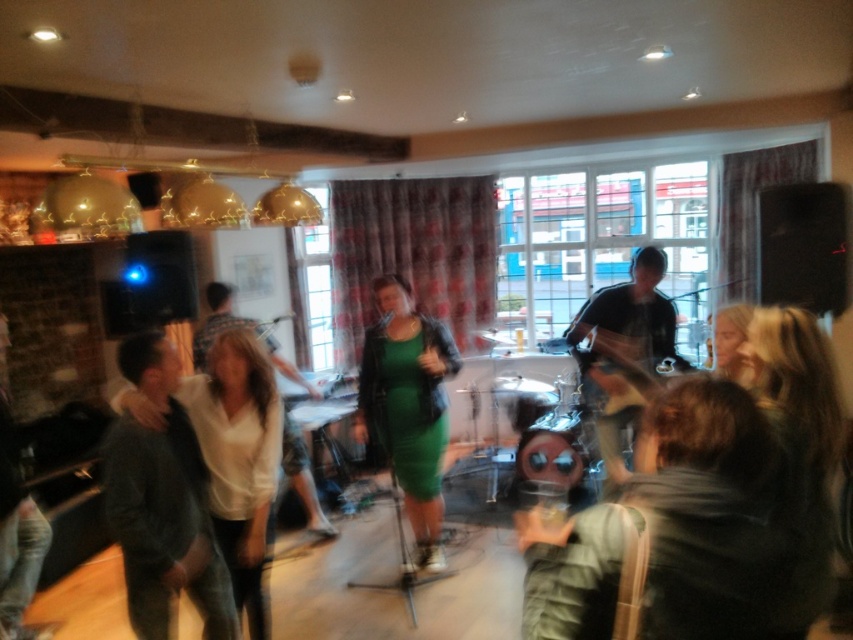
Where is `green leather dress at center`? green leather dress at center is located at coordinates (408, 406).

The height and width of the screenshot is (640, 853). Describe the element at coordinates (408, 406) in the screenshot. I see `green leather dress at center` at that location.

Who is more distant from viewer, [393,340] or [206,326]?

The point [206,326] is behind.

Find the location of `green leather dress at center`. green leather dress at center is located at coordinates (408, 406).

Between dark green sweater at left and white matte shirt at center, which one appears on the right side from the viewer's perspective?

dark green sweater at left

Is dark green sweater at left to the left of white matte shirt at center from the viewer's perspective?

No, dark green sweater at left is not to the left of white matte shirt at center.

Does point (207, 579) come closer to viewer compared to point (312, 525)?

Yes.

Image resolution: width=853 pixels, height=640 pixels. Find the location of `dark green sweater at left`. dark green sweater at left is located at coordinates [161, 504].

You are a GUI agent. You are given a task and a screenshot of the screen. Output one action in this format:
    pyautogui.click(x=<x>, y=<y>)
    Task: Click on the matte black shirt at center
    The height and width of the screenshot is (640, 853).
    Given the screenshot: What is the action you would take?
    pyautogui.click(x=624, y=344)

Between point (616, 294) and point (294, 452), which one is positioned in front?

Point (616, 294) is more forward.

Who is more forward, (x=619, y=336) or (x=254, y=320)?

Point (x=619, y=336) is more forward.

The width and height of the screenshot is (853, 640). I want to click on matte black shirt at center, so click(624, 344).